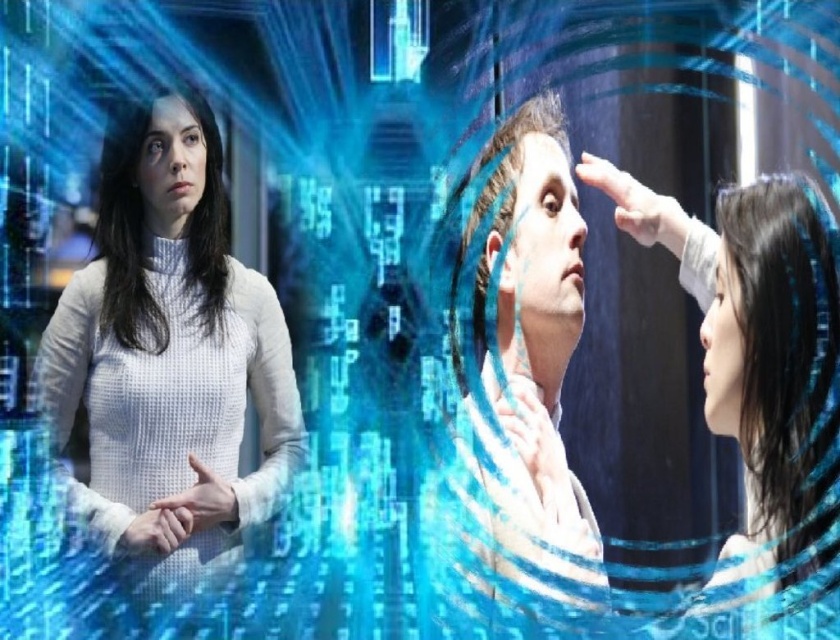
In the scene shown: You are a medical professional assessing the distance between the matte white hand at center and the smooth skin forehead at center in the futuristic scene. The minimum safe distance for a medical procedure is 1 meter. Is the current distance sufficient?

The distance between the matte white hand at center and the smooth skin forehead at center is 90.90 centimeters, which is less than the required 1 meter. Therefore, the current distance is insufficient for the medical procedure.

You are a virtual assistant in a futuristic setting. You need to determine which object is smaller between the matte white hand at center and the smooth skin forehead at center. Based on the scene, which one is smaller?

The matte white hand at center is smaller compared to the smooth skin forehead at center.

Where is the black matte hair at left located in the image?

The black matte hair at left is located at point (145, 228) in the image.